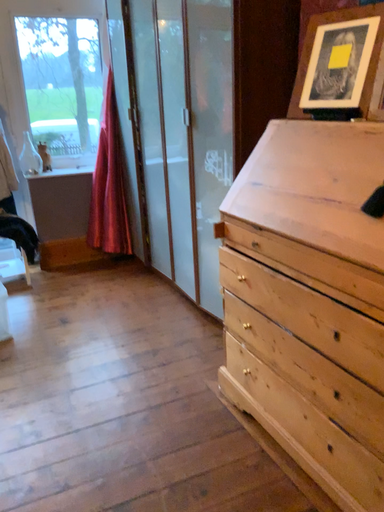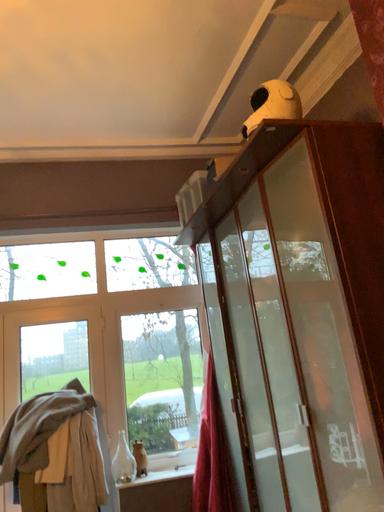
Question: How did the camera likely rotate when shooting the video?

Choices:
 (A) rotated downward
 (B) rotated upward

Answer: (B)